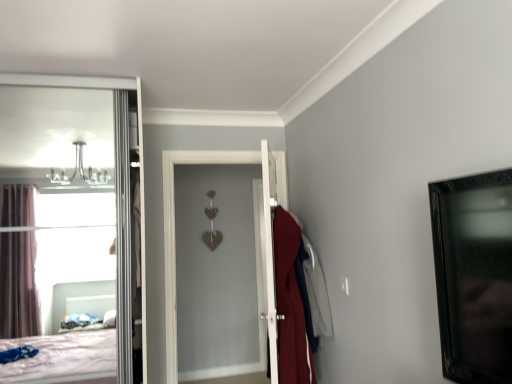
The image size is (512, 384). Identify the location of velvet red robe at center. (317, 293).

The image size is (512, 384). Describe the element at coordinates (317, 293) in the screenshot. I see `velvet red robe at center` at that location.

I want to click on black glossy picture frame at right, so click(474, 275).

Image resolution: width=512 pixels, height=384 pixels. Describe the element at coordinates (474, 275) in the screenshot. I see `black glossy picture frame at right` at that location.

The height and width of the screenshot is (384, 512). In order to click on velvet red robe at center in this screenshot , I will do [x=317, y=293].

In the scene shown: Which is more to the left, velvet red robe at center or black glossy picture frame at right?

From the viewer's perspective, velvet red robe at center appears more on the left side.

Between velvet red robe at center and black glossy picture frame at right, which one is positioned behind?

velvet red robe at center is further from the camera.

Which is nearer, (x=319, y=326) or (x=463, y=368)?

Point (x=319, y=326).

From the image's perspective, is velvet red robe at center below black glossy picture frame at right?

Yes.

From a real-world perspective, is velvet red robe at center on top of black glossy picture frame at right?

No, from a real-world perspective, velvet red robe at center is not over black glossy picture frame at right

Looking at their sizes, would you say velvet red robe at center is wider or thinner than black glossy picture frame at right?

Considering their sizes, velvet red robe at center looks broader than black glossy picture frame at right.

Is velvet red robe at center shorter than black glossy picture frame at right?

In fact, velvet red robe at center may be taller than black glossy picture frame at right.

Which of these two, velvet red robe at center or black glossy picture frame at right, is bigger?

velvet red robe at center.

Would you say black glossy picture frame at right is part of velvet red robe at center's contents?

No, black glossy picture frame at right is located outside of velvet red robe at center.

Does velvet red robe at center touch black glossy picture frame at right?

No, velvet red robe at center is not with black glossy picture frame at right.

Is velvet red robe at center looking in the opposite direction of black glossy picture frame at right?

velvet red robe at center is not turned away from black glossy picture frame at right.

How many degrees apart are the facing directions of velvet red robe at center and black glossy picture frame at right?

The angle between the facing direction of velvet red robe at center and the facing direction of black glossy picture frame at right is 90.6 degrees.

Measure the distance between velvet red robe at center and black glossy picture frame at right.

velvet red robe at center and black glossy picture frame at right are 1.28 meters apart from each other.

Where is `robe that appears behind the black glossy picture frame at right`? This screenshot has height=384, width=512. robe that appears behind the black glossy picture frame at right is located at coordinates (317, 293).

Considering the relative positions of black glossy picture frame at right and velvet red robe at center in the image provided, is black glossy picture frame at right to the left of velvet red robe at center from the viewer's perspective?

No.

Which is in front, black glossy picture frame at right or velvet red robe at center?

black glossy picture frame at right.

Which is behind, point (471, 270) or point (318, 315)?

The point (318, 315) is farther from the camera.

From the image's perspective, is black glossy picture frame at right over velvet red robe at center?

Yes, from the image's perspective, black glossy picture frame at right is over velvet red robe at center.

From a real-world perspective, is black glossy picture frame at right over velvet red robe at center?

Yes.

Considering the sizes of objects black glossy picture frame at right and velvet red robe at center in the image provided, who is thinner, black glossy picture frame at right or velvet red robe at center?

Thinner between the two is black glossy picture frame at right.

Is black glossy picture frame at right taller than velvet red robe at center?

In fact, black glossy picture frame at right may be shorter than velvet red robe at center.

Considering the sizes of objects black glossy picture frame at right and velvet red robe at center in the image provided, who is smaller, black glossy picture frame at right or velvet red robe at center?

black glossy picture frame at right is smaller.

Choose the correct answer: Is black glossy picture frame at right inside velvet red robe at center or outside it?

black glossy picture frame at right is not inside velvet red robe at center, it's outside.

Is black glossy picture frame at right beside velvet red robe at center?

black glossy picture frame at right is not next to velvet red robe at center, and they're not touching.

Is black glossy picture frame at right positioned with its back to velvet red robe at center?

No, black glossy picture frame at right is not facing away from velvet red robe at center.

In the scene shown: How different are the orientations of black glossy picture frame at right and velvet red robe at center in degrees?

The angle between the facing direction of black glossy picture frame at right and the facing direction of velvet red robe at center is 90.6 degrees.

This screenshot has width=512, height=384. In the image, there is a black glossy picture frame at right. What are the coordinates of `robe below it (from the image's perspective)` in the screenshot? It's located at (317, 293).

What are the coordinates of `picture frame lying on the right of velvet red robe at center` in the screenshot? It's located at (474, 275).

Identify the location of picture frame in front of the velvet red robe at center. This screenshot has height=384, width=512. (474, 275).